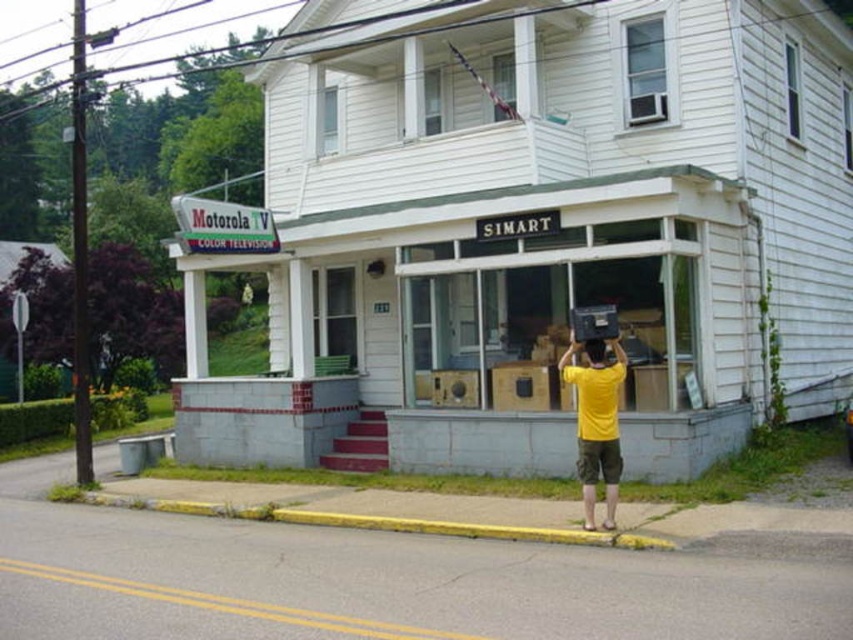
Is point (189, 316) positioned after point (314, 518)?

Yes, it is behind point (314, 518).

Consider the image. Which of these two, white wood storefront at center or yellow painted curb at lower center, stands shorter?

Standing shorter between the two is yellow painted curb at lower center.

Between point (590, 48) and point (581, 531), which one is positioned behind?

The point (590, 48) is behind.

This screenshot has width=853, height=640. In order to click on white wood storefront at center in this screenshot , I will do `click(538, 230)`.

Can you confirm if yellow painted curb at lower center is shorter than yellow matte shirt at center?

Yes.

Is yellow painted curb at lower center wider than yellow matte shirt at center?

In fact, yellow painted curb at lower center might be narrower than yellow matte shirt at center.

Is point (413, 529) closer to camera compared to point (607, 445)?

That is False.

You are a GUI agent. You are given a task and a screenshot of the screen. Output one action in this format:
    pyautogui.click(x=<x>, y=<y>)
    Task: Click on the yellow painted curb at lower center
    The height and width of the screenshot is (640, 853).
    Given the screenshot: What is the action you would take?
    pyautogui.click(x=376, y=522)

Does point (352, 216) come in front of point (579, 385)?

No, (352, 216) is behind (579, 385).

Which is above, white wood storefront at center or yellow matte shirt at center?

Positioned higher is white wood storefront at center.

Image resolution: width=853 pixels, height=640 pixels. Identify the location of white wood storefront at center. (538, 230).

You are a GUI agent. You are given a task and a screenshot of the screen. Output one action in this format:
    pyautogui.click(x=<x>, y=<y>)
    Task: Click on the white wood storefront at center
    The height and width of the screenshot is (640, 853).
    Given the screenshot: What is the action you would take?
    pyautogui.click(x=538, y=230)